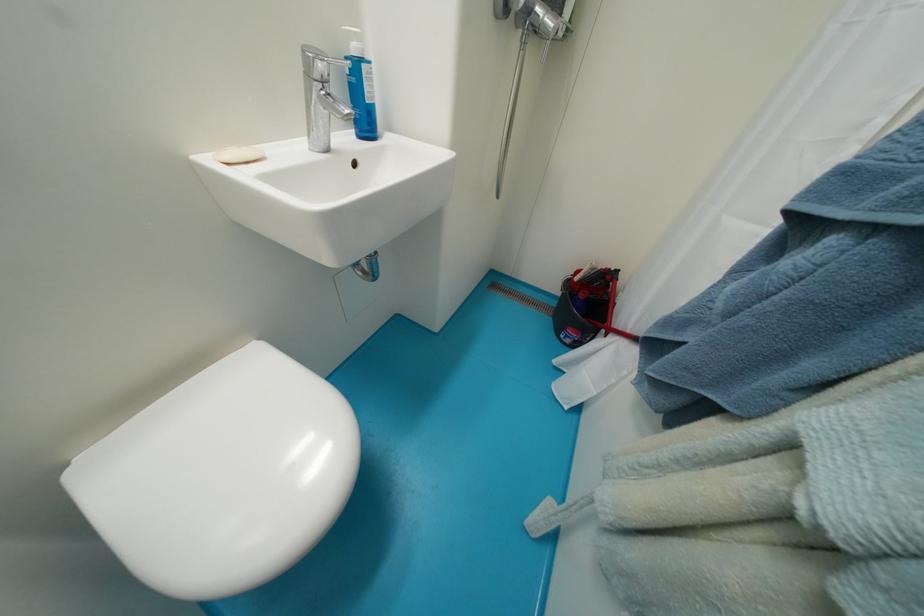
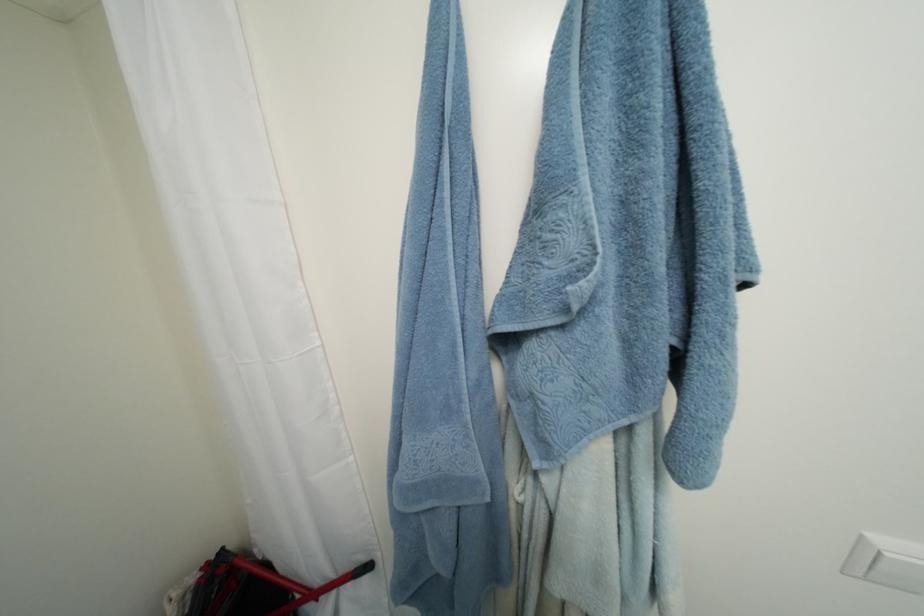
Based on the continuous images, in which direction is the camera rotating?

The camera's rotation is toward right-down.